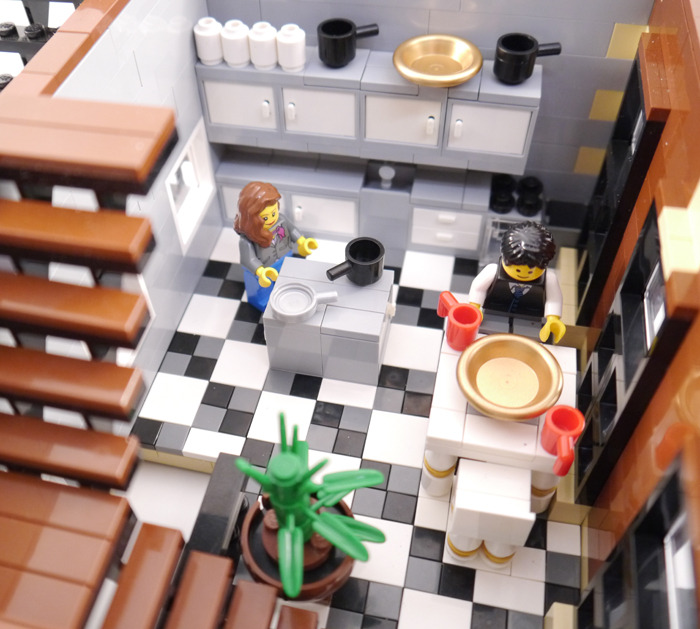
Where is `black floor tile`? black floor tile is located at coordinates (201, 367).